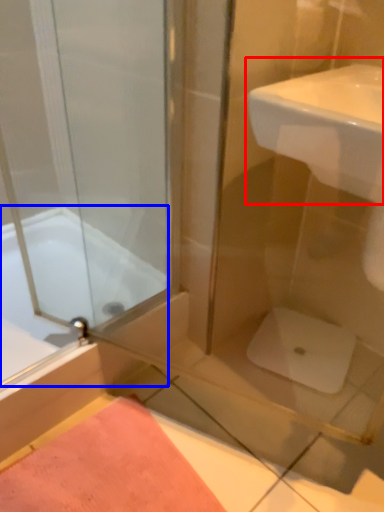
Question: Which point is further to the camera, sink (highlighted by a red box) or bathtub (highlighted by a blue box)?

Choices:
 (A) sink
 (B) bathtub

Answer: (B)